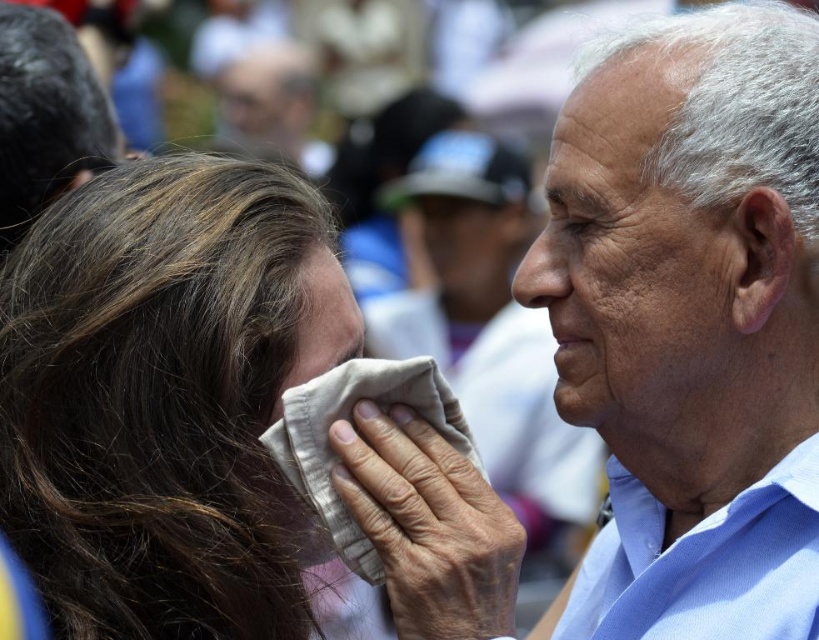
Question: Which point appears closest to the camera in this image?

Choices:
 (A) (623, 410)
 (B) (308, 355)
 (C) (10, 481)
 (D) (467, 506)

Answer: (D)

Question: From the image, what is the correct spatial relationship of light blue shirt at center in relation to smooth beige cloth at center?

Choices:
 (A) above
 (B) below

Answer: (B)

Question: Is dark brown hair at left above smooth beige cloth at center?

Choices:
 (A) yes
 (B) no

Answer: (B)

Question: Which of the following is the closest to the observer?

Choices:
 (A) (88, 225)
 (B) (550, 627)
 (C) (582, 134)
 (D) (295, 342)

Answer: (D)

Question: Can you confirm if dark brown hair at left is thinner than smooth skin face at right?

Choices:
 (A) yes
 (B) no

Answer: (B)

Question: Which of the following is the closest to the observer?

Choices:
 (A) (319, 288)
 (B) (247, 371)
 (C) (750, 486)

Answer: (B)